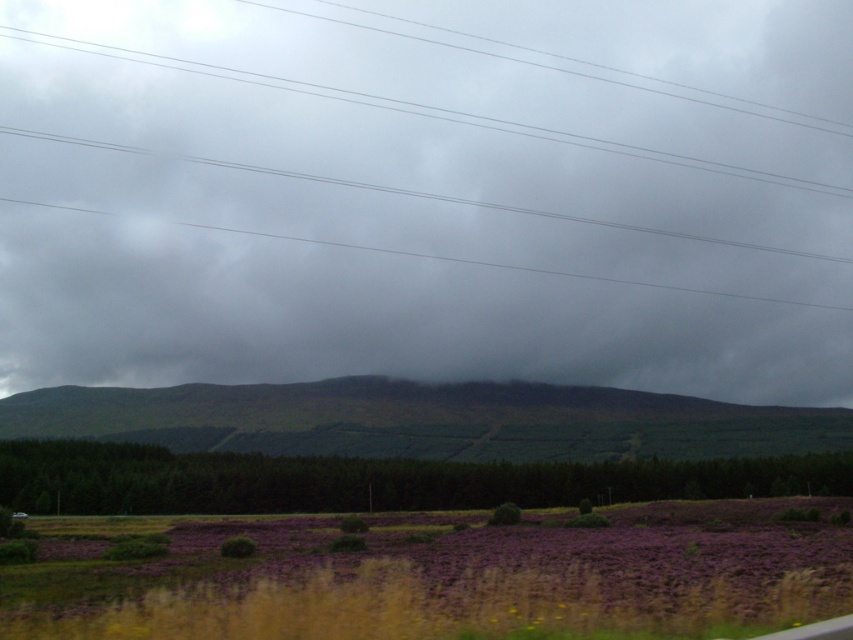
Which is more to the left, gray matte cloud at center or green grassy hill at center?

Positioned to the left is gray matte cloud at center.

Find the location of a particular element. gray matte cloud at center is located at coordinates (415, 144).

Locate an element on the screen. The width and height of the screenshot is (853, 640). gray matte cloud at center is located at coordinates (415, 144).

Which is behind, point (4, 58) or point (302, 547)?

The point (4, 58) is more distant.

Which of these two, gray matte cloud at center or purple soft-textured flowers at lower center, stands shorter?

purple soft-textured flowers at lower center is shorter.

Between point (32, 358) and point (543, 547), which one is positioned in front?

Point (543, 547) is in front.

Where is `gray matte cloud at center`? gray matte cloud at center is located at coordinates (415, 144).

Is purple soft-textured flowers at lower center further to the viewer compared to green grassy hill at center?

No, purple soft-textured flowers at lower center is closer to the viewer.

Does purple soft-textured flowers at lower center appear on the right side of green grassy hill at center?

Indeed, purple soft-textured flowers at lower center is positioned on the right side of green grassy hill at center.

Is point (432, 538) farther from camera compared to point (706, 429)?

That is False.

The image size is (853, 640). What are the coordinates of `purple soft-textured flowers at lower center` in the screenshot? It's located at (440, 576).